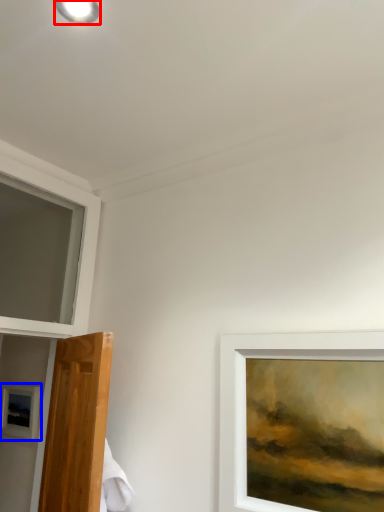
Question: Which object appears closest to the camera in this image, droplight (highlighted by a red box) or picture frame (highlighted by a blue box)?

Choices:
 (A) droplight
 (B) picture frame

Answer: (A)